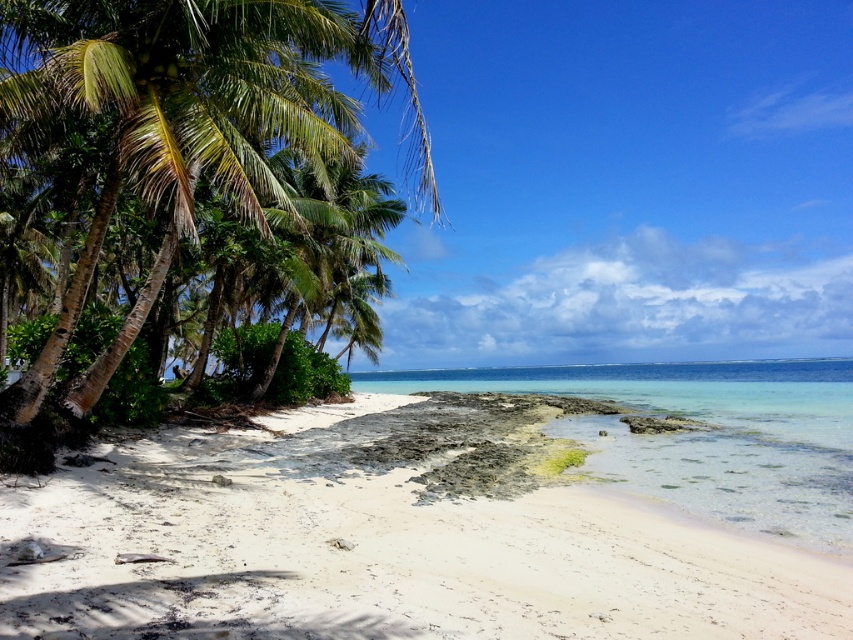
Which is more to the left, green leafy palm tree at left or clear sand at lower center?

From the viewer's perspective, green leafy palm tree at left appears more on the left side.

Does green leafy palm tree at left appear over clear sand at lower center?

Correct, green leafy palm tree at left is located above clear sand at lower center.

Who is more distant from viewer, (170, 196) or (418, 390)?

Positioned behind is point (418, 390).

You are a GUI agent. You are given a task and a screenshot of the screen. Output one action in this format:
    pyautogui.click(x=<x>, y=<y>)
    Task: Click on the green leafy palm tree at left
    The width and height of the screenshot is (853, 640).
    Given the screenshot: What is the action you would take?
    pyautogui.click(x=189, y=115)

From the picture: Can you confirm if white sandy beach at lower left is taller than green leafy palm tree at left?

Incorrect, white sandy beach at lower left's height is not larger of green leafy palm tree at left's.

Between white sandy beach at lower left and green leafy palm tree at left, which one has more height?

green leafy palm tree at left is taller.

What do you see at coordinates (381, 540) in the screenshot? I see `white sandy beach at lower left` at bounding box center [381, 540].

Find the location of a particular element. The height and width of the screenshot is (640, 853). white sandy beach at lower left is located at coordinates (381, 540).

Is point (299, 636) less distant than point (775, 422)?

Yes, point (299, 636) is closer to viewer.

Is white sandy beach at lower left to the left of clear sand at lower center from the viewer's perspective?

Indeed, white sandy beach at lower left is positioned on the left side of clear sand at lower center.

Is point (16, 636) in front of point (653, 438)?

Yes, point (16, 636) is closer to viewer.

Where is `white sandy beach at lower left`? white sandy beach at lower left is located at coordinates (381, 540).